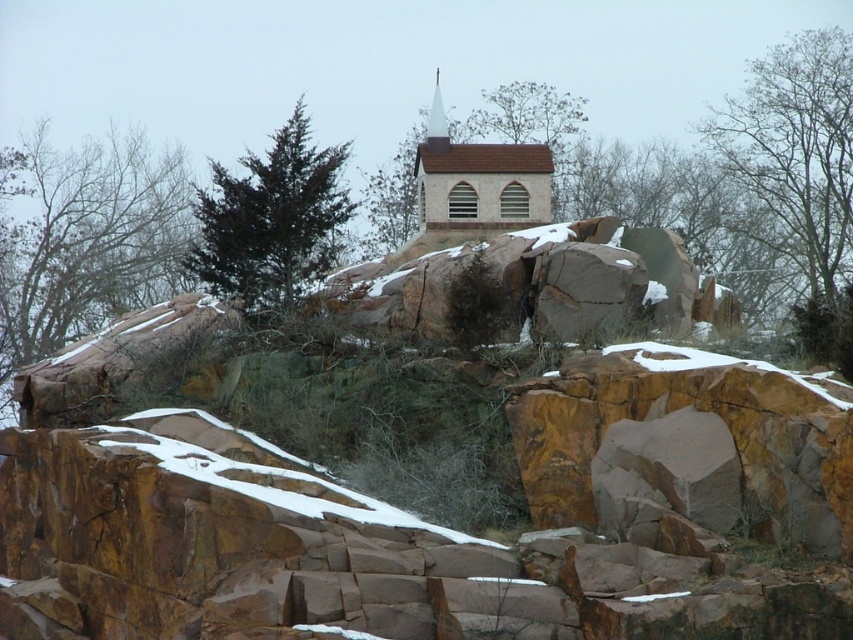
Question: Is green leafy tree at upper left thinner than dark green coniferous tree at upper center?

Choices:
 (A) no
 (B) yes

Answer: (A)

Question: Which point is closer to the camera?

Choices:
 (A) green leafy tree at upper left
 (B) bare branches at upper right

Answer: (B)

Question: Does green leafy tree at upper left have a larger size compared to bare branches at upper right?

Choices:
 (A) no
 (B) yes

Answer: (A)

Question: Is green leafy tree at upper left behind smooth brown church steeple at center?

Choices:
 (A) yes
 (B) no

Answer: (A)

Question: Which point is closer to the camera taking this photo?

Choices:
 (A) (279, 164)
 (B) (799, 161)
 (C) (32, 337)
 (D) (424, 218)

Answer: (A)

Question: Which point is farther to the camera?

Choices:
 (A) (543, 193)
 (B) (302, 179)
 (C) (833, 204)
 (D) (33, 140)

Answer: (D)